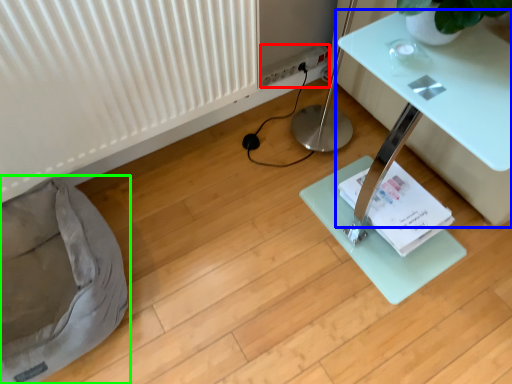
Question: Which object is positioned farthest from electric outlet (highlighted by a red box)? Select from table (highlighted by a blue box) and bean bag chair (highlighted by a green box).

Choices:
 (A) table
 (B) bean bag chair

Answer: (B)